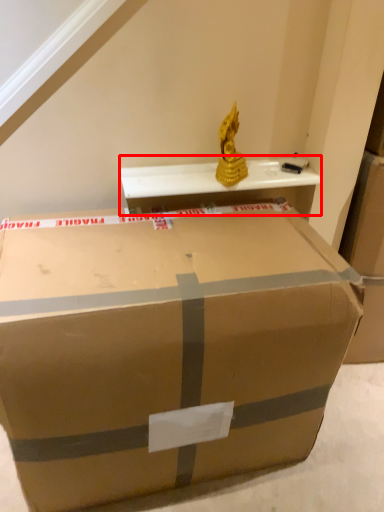
Question: From the image's perspective, what is the correct spatial relationship of table (annotated by the red box) in relation to box?

Choices:
 (A) above
 (B) below

Answer: (A)